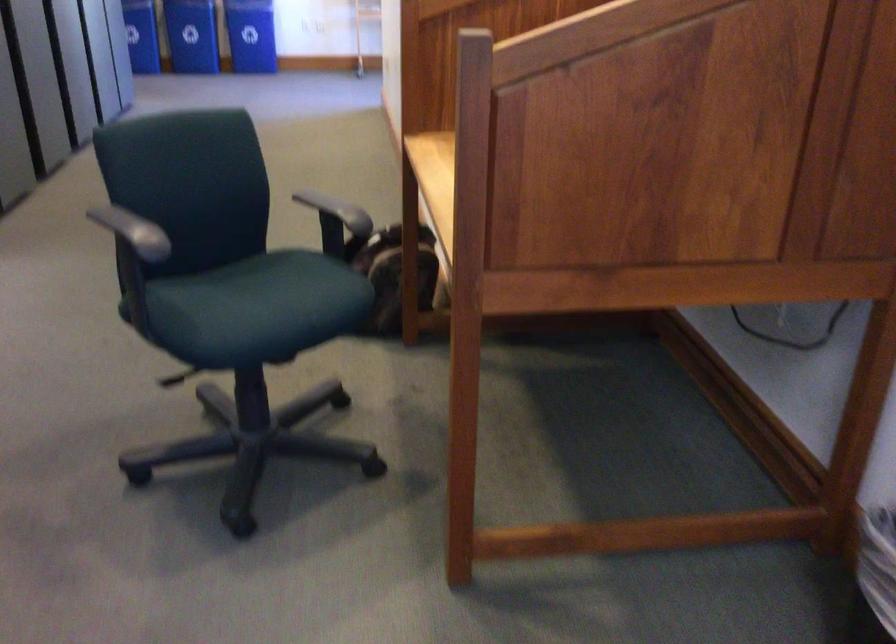
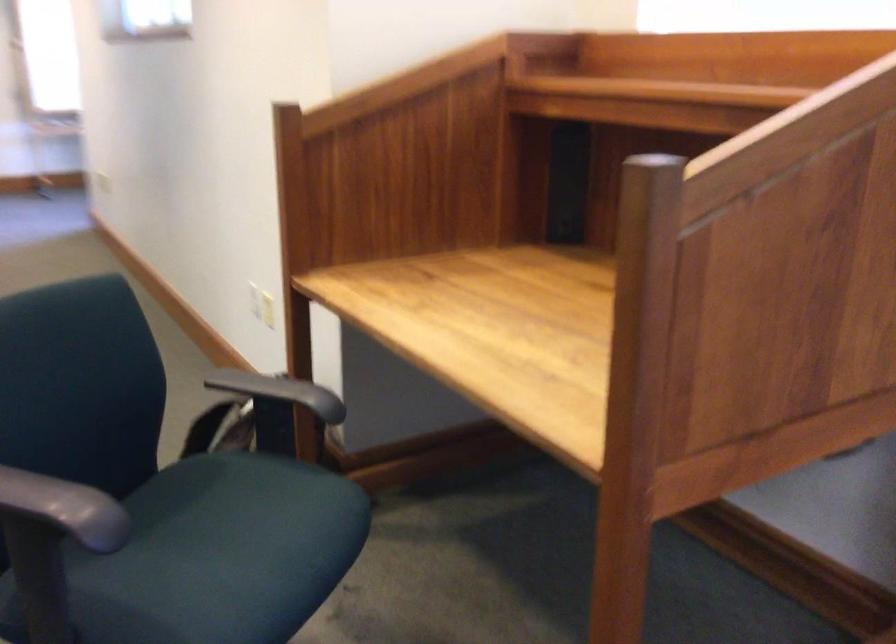
Question: The camera is either moving clockwise (left) or counter-clockwise (right) around the object. The first image is from the beginning of the video and the second image is from the end. Is the camera moving left or right when shooting the video?

Choices:
 (A) Left
 (B) Right

Answer: (A)